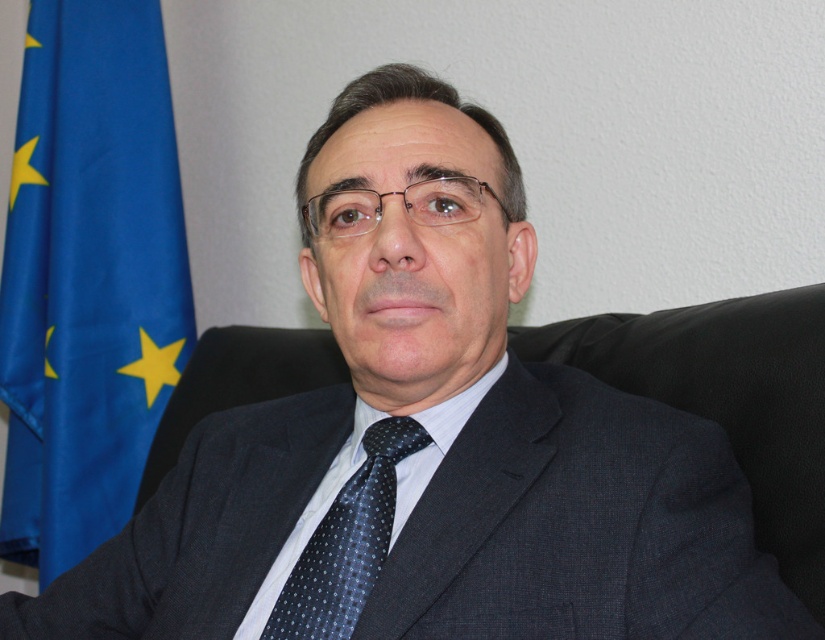
You are a photographer adjusting the lighting in the office. You notice the blue fabric flag at left and the dark blue dotted silk tie at center. Which object is closer to the camera?

The dark blue dotted silk tie at center is closer to the camera since it is only 1.08 meters away from the blue fabric flag at left, and the flag is further back.

You are a photographer adjusting the lighting in the office. You notice the blue fabric flag at left and the dark blue dotted silk tie at center. Which object is positioned higher in the frame?

The blue fabric flag at left is located above the dark blue dotted silk tie at center, so it is positioned higher in the frame.

You are an interior designer asked to hang a new decoration in the office. The blue fabric flag at left and the dark blue dotted silk tie at center are already present. Which object requires more space due to its size?

The blue fabric flag at left requires more space due to its larger size compared to the dark blue dotted silk tie at center.